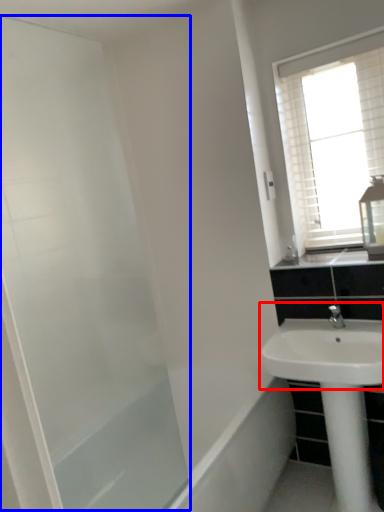
Question: Which object appears farthest to the camera in this image, sink (highlighted by a red box) or screen door (highlighted by a blue box)?

Choices:
 (A) sink
 (B) screen door

Answer: (A)